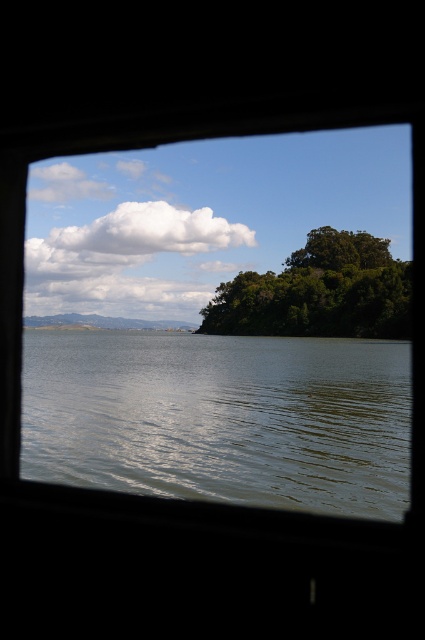
Measure the distance between greenish reflective water at center and camera.

greenish reflective water at center and camera are 27.62 feet apart.

Is greenish reflective water at center bigger than green leafy tree at center?

Actually, greenish reflective water at center might be smaller than green leafy tree at center.

Is point (218, 336) positioned before point (303, 332)?

No.

The height and width of the screenshot is (640, 425). Find the location of `greenish reflective water at center`. greenish reflective water at center is located at coordinates (221, 417).

From the picture: Does transparent glass window at center appear on the right side of greenish reflective water at center?

Yes, transparent glass window at center is to the right of greenish reflective water at center.

Consider the image. How much distance is there between transparent glass window at center and greenish reflective water at center?

transparent glass window at center is 44.23 meters away from greenish reflective water at center.

Which is in front, point (277, 182) or point (51, 440)?

Positioned in front is point (51, 440).

Where is `transparent glass window at center`? This screenshot has height=640, width=425. transparent glass window at center is located at coordinates (221, 323).

Which is above, transparent glass window at center or green leafy tree at center?

Positioned higher is transparent glass window at center.

Which is in front, point (393, 401) or point (367, 252)?

Positioned in front is point (393, 401).

The height and width of the screenshot is (640, 425). I want to click on transparent glass window at center, so click(221, 323).